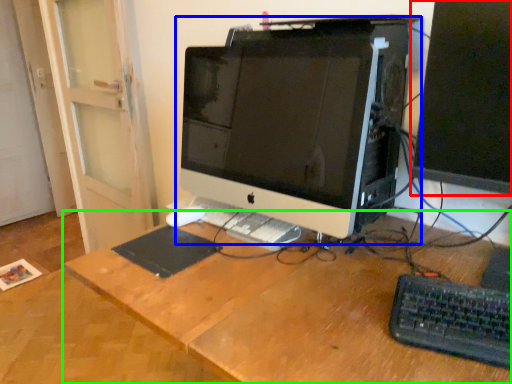
Question: Which object is the closest to the computer monitor (highlighted by a red box)? Choose among these: computer monitor (highlighted by a blue box) or desk (highlighted by a green box).

Choices:
 (A) computer monitor
 (B) desk

Answer: (A)